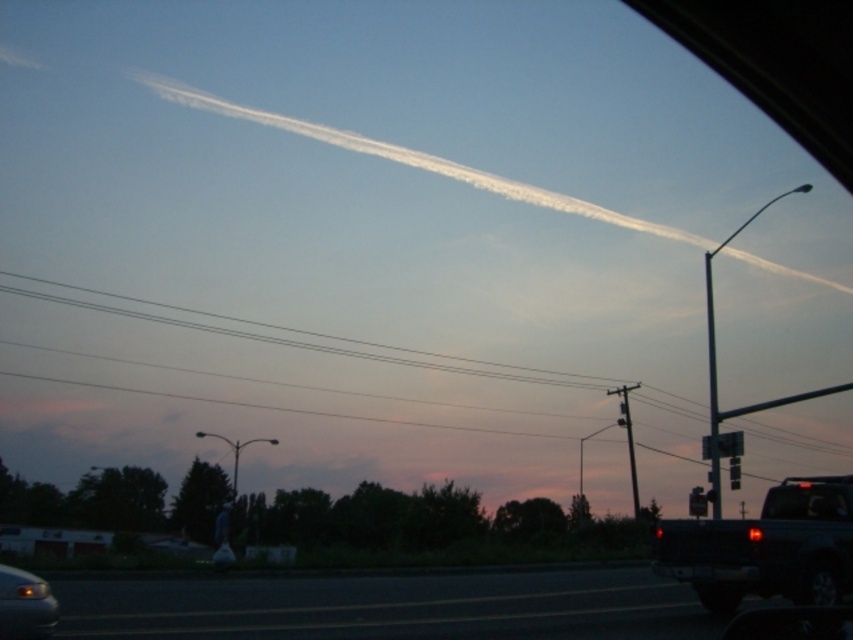
Is matte black truck at lower right below matte black car at lower left?

Correct, matte black truck at lower right is located below matte black car at lower left.

The width and height of the screenshot is (853, 640). What do you see at coordinates (766, 547) in the screenshot? I see `matte black truck at lower right` at bounding box center [766, 547].

Locate an element on the screen. The image size is (853, 640). matte black truck at lower right is located at coordinates (766, 547).